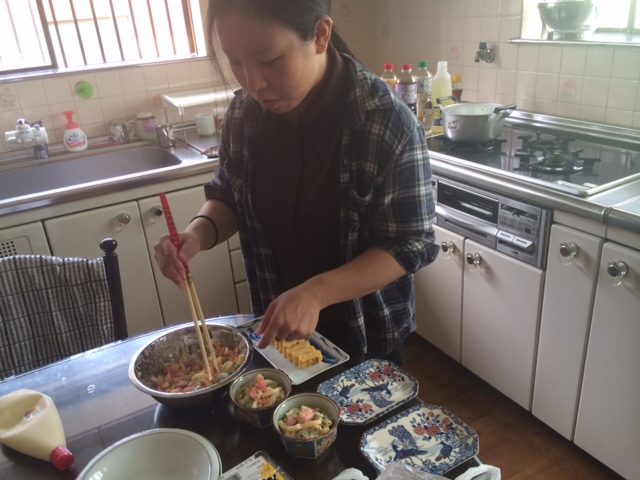
Find the location of `pot`. pot is located at coordinates [464, 128].